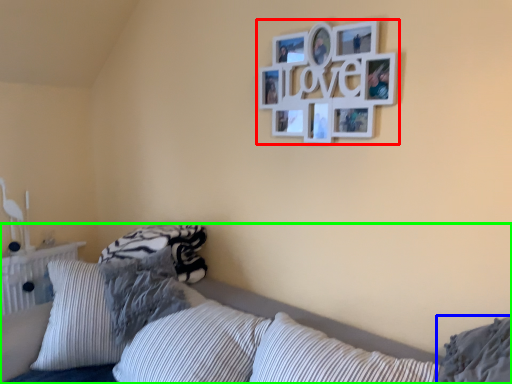
Question: Which is farther away from picture frame (highlighted by a red box)? pillow (highlighted by a blue box) or bed (highlighted by a green box)?

Choices:
 (A) pillow
 (B) bed

Answer: (A)